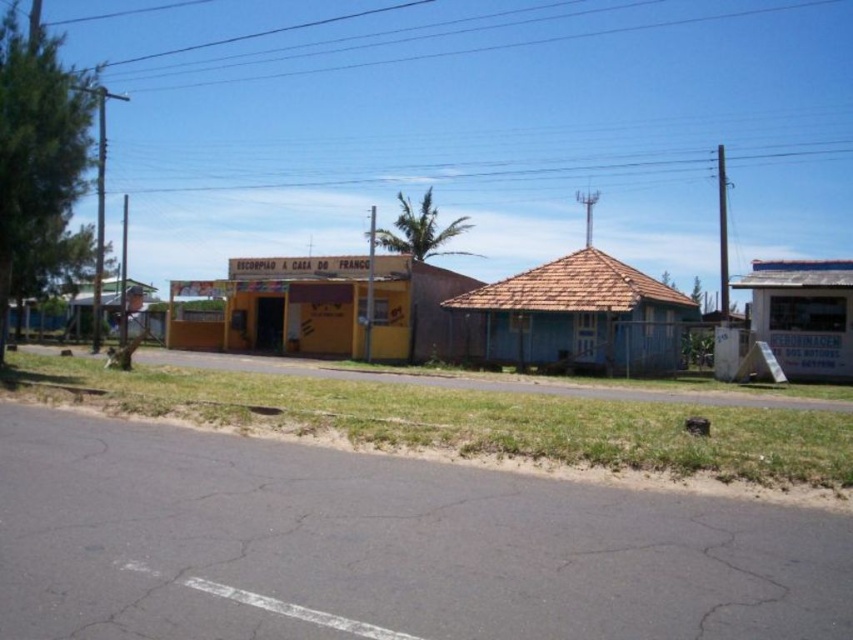
Locate an element on the screen. The image size is (853, 640). yellow painted wood hut at center is located at coordinates [329, 308].

Between point (212, 330) and point (129, 314), which one is positioned in front?

Point (212, 330)

Find the location of `yellow painted wood hut at center`. yellow painted wood hut at center is located at coordinates click(329, 308).

Looking at this image, does yellow painted wood hut at center appear on the left side of white corrugated metal hut at right?

Indeed, yellow painted wood hut at center is positioned on the left side of white corrugated metal hut at right.

Can you confirm if yellow painted wood hut at center is positioned to the right of white corrugated metal hut at right?

In fact, yellow painted wood hut at center is to the left of white corrugated metal hut at right.

At what (x,y) coordinates should I click in order to perform the action: click on yellow painted wood hut at center. Please return your answer as a coordinate pair (x, y). Looking at the image, I should click on (329, 308).

Which is behind, point (821, 288) or point (80, 332)?

Positioned behind is point (80, 332).

Image resolution: width=853 pixels, height=640 pixels. Find the location of `white corrugated metal hut at right`. white corrugated metal hut at right is located at coordinates (804, 314).